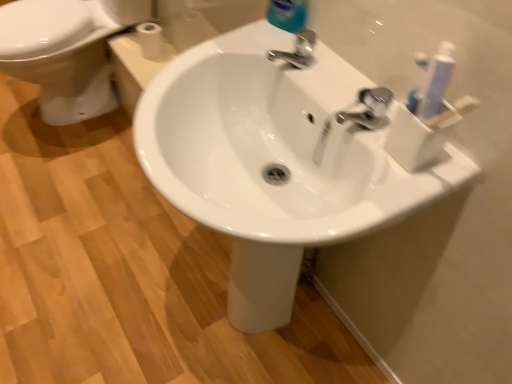
Question: Considering the positions of blue glossy bottle at upper center and silver metallic faucet at upper center, positioned as the 1th tap in top-to-bottom order, in the image, is blue glossy bottle at upper center taller or shorter than silver metallic faucet at upper center, positioned as the 1th tap in top-to-bottom order,?

Choices:
 (A) short
 (B) tall

Answer: (B)

Question: Which is correct: blue glossy bottle at upper center is inside silver metallic faucet at upper center, which is the 1th tap from left to right, or outside of it?

Choices:
 (A) inside
 (B) outside

Answer: (B)

Question: Which object is the farthest from the white glossy bidet at left?

Choices:
 (A) white glossy sink at center
 (B) blue glossy bottle at upper center
 (C) polished chrome faucet at upper right, the 2th tap viewed from the back
 (D) white matte toilet paper at upper left
 (E) silver metallic faucet at upper center, which is the first tap from back to front

Answer: (C)

Question: Which object is positioned closest to the white glossy bidet at left?

Choices:
 (A) silver metallic faucet at upper center, positioned as the 1th tap in top-to-bottom order
 (B) white matte toilet paper at upper left
 (C) white glossy sink at center
 (D) blue glossy bottle at upper center
 (E) polished chrome faucet at upper right, which is the 2th tap from left to right

Answer: (B)